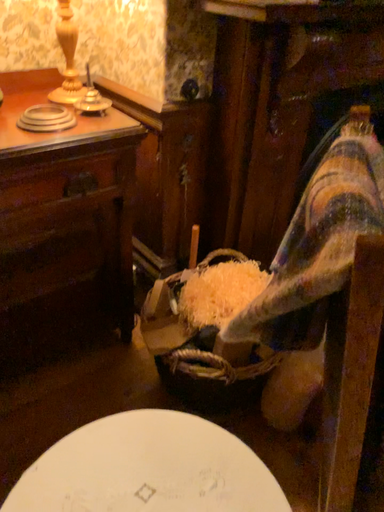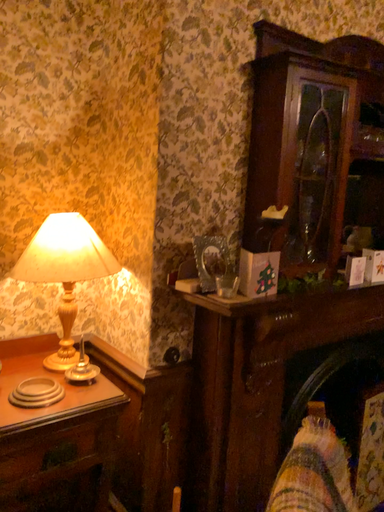
Question: Which way did the camera rotate in the video?

Choices:
 (A) rotated downward
 (B) rotated upward

Answer: (B)